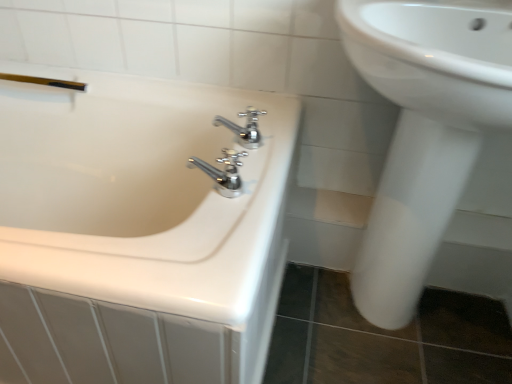
Question: Is chrome metallic faucet at center, arranged as the first tap when viewed from the top, taller or shorter than white glossy sink at right?

Choices:
 (A) short
 (B) tall

Answer: (A)

Question: In terms of width, does chrome metallic faucet at center, arranged as the first tap when viewed from the top, look wider or thinner when compared to white glossy sink at right?

Choices:
 (A) wide
 (B) thin

Answer: (B)

Question: Considering the real-world distances, which object is farthest from the white glossy sink at right?

Choices:
 (A) white glossy bathtub at left
 (B) chrome metallic faucet at center, which appears as the first tap when ordered from the bottom
 (C) chrome metallic faucet at center, the 2th tap ordered from the bottom
 (D) gold metallic shower at upper left

Answer: (D)

Question: Which of these objects is positioned farthest from the chrome metallic faucet at center, the 2th tap ordered from the bottom?

Choices:
 (A) gold metallic shower at upper left
 (B) chrome metallic faucet at center, which is counted as the second tap, starting from the back
 (C) white glossy sink at right
 (D) white glossy bathtub at left

Answer: (A)